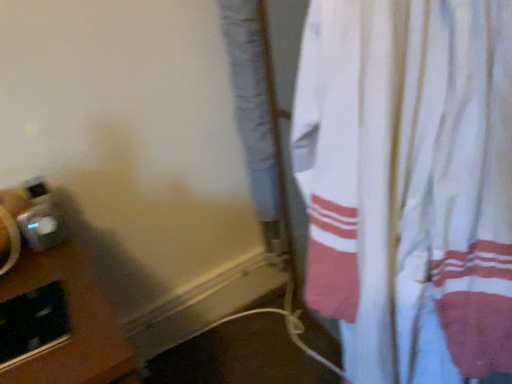
Question: Considering the positions of white cotton curtain at right and brown wooden table at lower left in the image, is white cotton curtain at right wider or thinner than brown wooden table at lower left?

Choices:
 (A) thin
 (B) wide

Answer: (A)

Question: Is white cotton curtain at right in front of or behind brown wooden table at lower left in the image?

Choices:
 (A) front
 (B) behind

Answer: (A)

Question: Does point (438, 266) appear closer or farther from the camera than point (48, 344)?

Choices:
 (A) closer
 (B) farther

Answer: (A)

Question: Is point (41, 379) closer or farther from the camera than point (433, 337)?

Choices:
 (A) closer
 (B) farther

Answer: (A)

Question: From a real-world perspective, is brown wooden table at lower left physically located above or below white cotton curtain at right?

Choices:
 (A) below
 (B) above

Answer: (A)

Question: From the image's perspective, is brown wooden table at lower left located above or below white cotton curtain at right?

Choices:
 (A) below
 (B) above

Answer: (A)

Question: In the image, is brown wooden table at lower left positioned in front of or behind white cotton curtain at right?

Choices:
 (A) front
 (B) behind

Answer: (B)